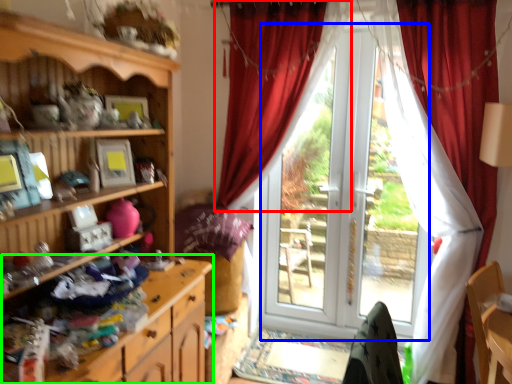
Question: Considering the real-world distances, which object is closest to curtain (highlighted by a red box)? screen door (highlighted by a blue box) or cabinetry (highlighted by a green box).

Choices:
 (A) screen door
 (B) cabinetry

Answer: (A)